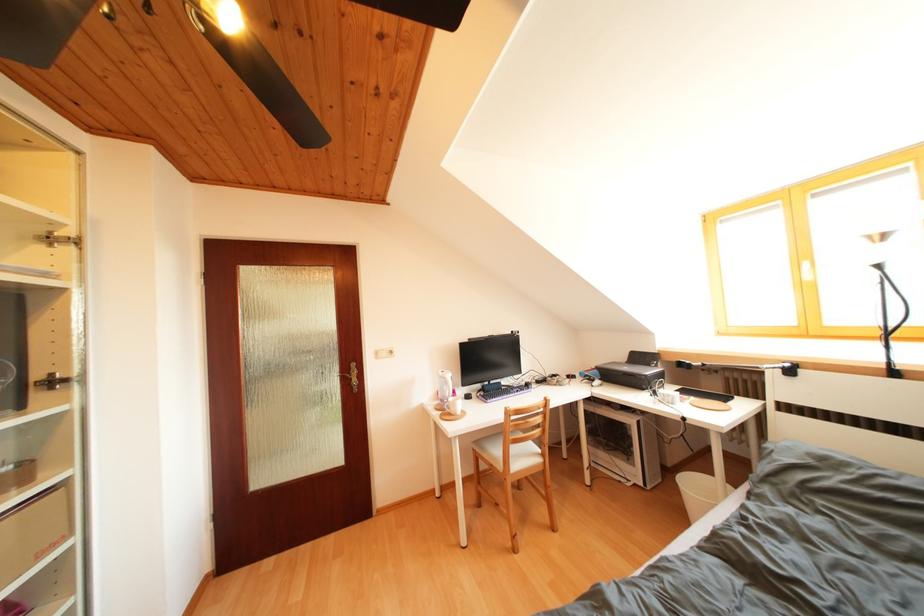
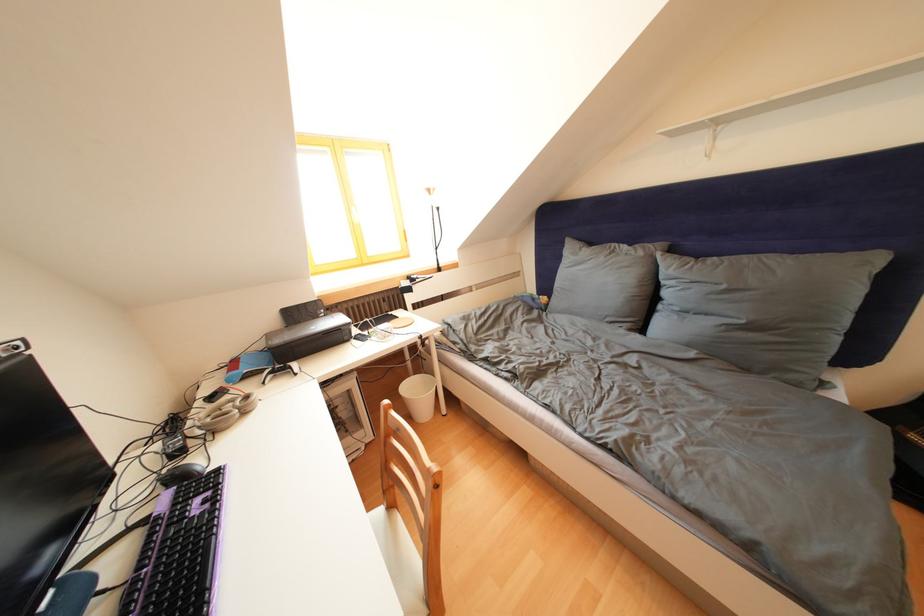
In the second image, find the point that corresponds to the point at 655,370 in the first image.

(323, 322)